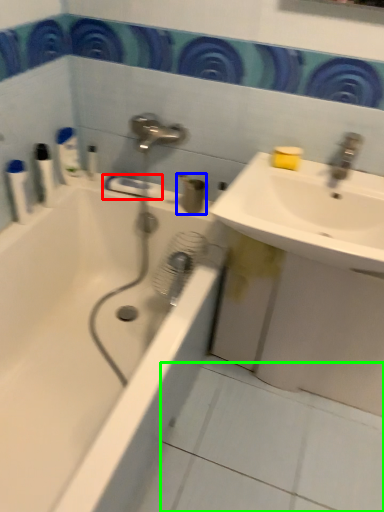
Question: Estimate the real-world distances between objects in this image. Which object is farther from towel bar (highlighted by a red box), toiletry (highlighted by a blue box) or ceramic tile (highlighted by a green box)?

Choices:
 (A) toiletry
 (B) ceramic tile

Answer: (B)